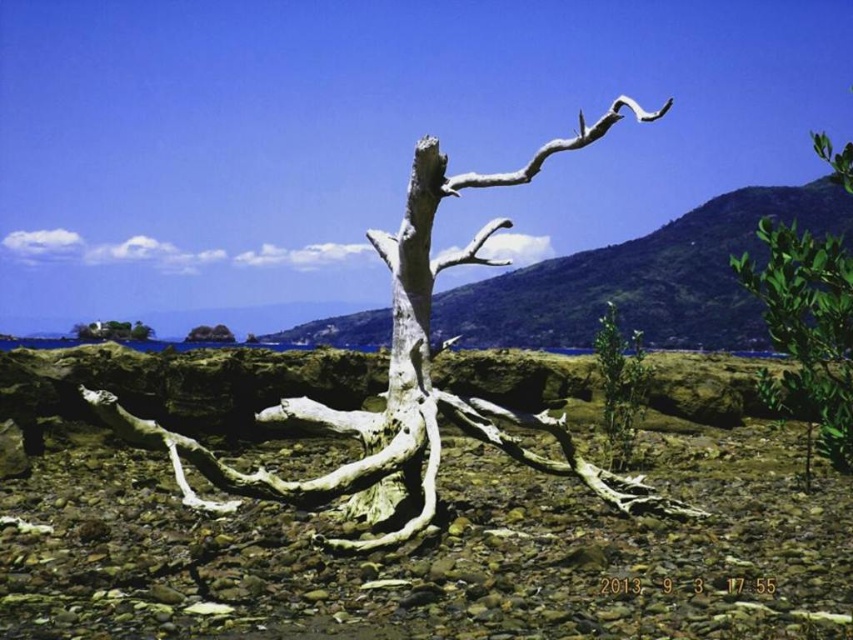
Question: Can you confirm if white rough wood at center is thinner than white textured driftwood at center?

Choices:
 (A) yes
 (B) no

Answer: (B)

Question: Among these points, which one is nearest to the camera?

Choices:
 (A) (635, 502)
 (B) (622, 396)
 (C) (109, 333)
 (D) (782, 344)

Answer: (D)

Question: Can you confirm if green leafy plant at center is positioned above smooth gray tree trunk at lower left?

Choices:
 (A) yes
 (B) no

Answer: (A)

Question: Which object appears closest to the camera in this image?

Choices:
 (A) green leafy plant at center
 (B) white rough wood at center
 (C) white textured driftwood at center
 (D) smooth gray tree trunk at lower left

Answer: (B)

Question: Considering the real-world distances, which object is closest to the green leafy bush at right?

Choices:
 (A) green leafy plant at center
 (B) white rough wood at center
 (C) smooth gray tree trunk at lower left

Answer: (A)

Question: Is white rough wood at center further to camera compared to white textured driftwood at center?

Choices:
 (A) no
 (B) yes

Answer: (A)